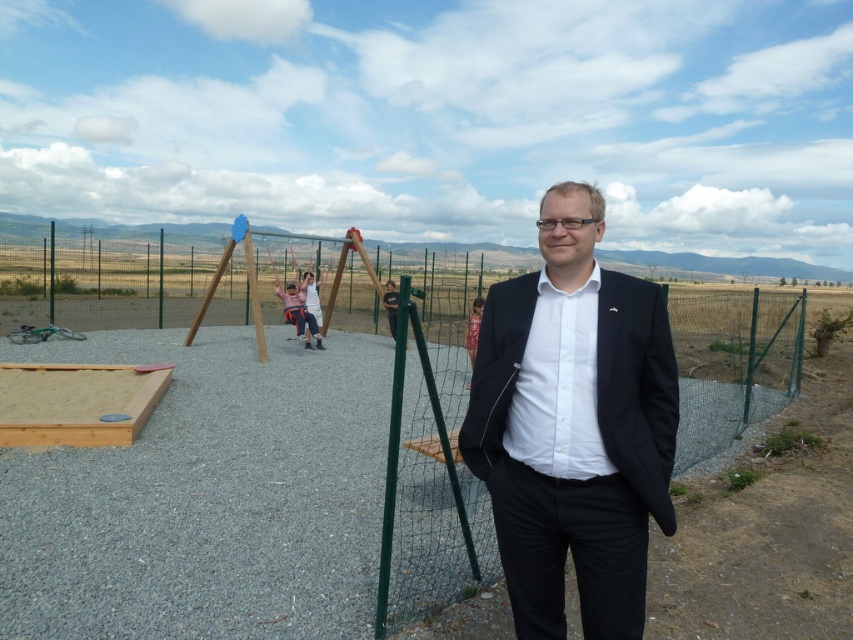
You are standing at the green metal fence and want to take a photo of both point (616, 598) and point (680, 356) in the playground. Which point should you focus on first to ensure both are in frame?

You should focus on point (616, 598) first because it is closer to the viewer than point (680, 356), ensuring both points are within the camera frame.

You are a photographer trying to capture a clear shot of the black matte suit at center and the green wire mesh fence at right. Considering their sizes, which object should you focus on first to ensure both are in frame?

The black matte suit at center has a smaller size compared to the green wire mesh fence at right, so you should focus on the black matte suit at center first to ensure it is in frame before adjusting for the larger fence.

You are standing at the center of the playground and want to locate the green wire mesh fence at right. According to the coordinates provided, in which direction should you look to find it?

The green wire mesh fence at right is located at coordinates point 0.558 on the x axis and 0.860 on the y axis. Since the x coordinate is 0.558, which is slightly to the right of center, and the y coordinate is 0.860, which is towards the top of the image, you should look towards the upper right direction to locate it.